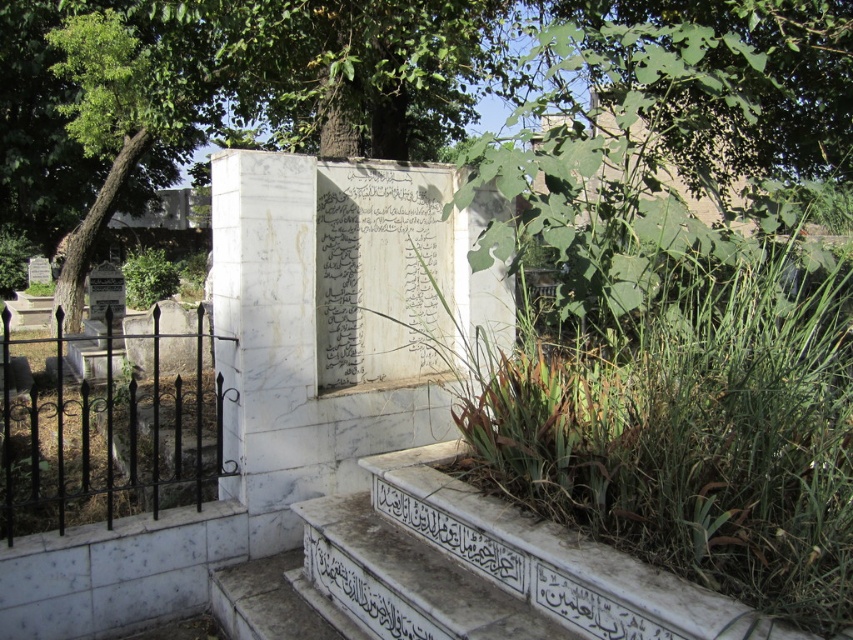
You are a maintenance worker tasked with measuring the width of the black wrought iron fence at left and the black stone inscription at lower center. Based on the scene, which object do you think is wider?

The black wrought iron fence at left might be wider than black stone inscription at lower center according to the description.

You are visiting a cemetery and want to read the black stone inscription at lower center. However, you notice a black wrought iron fence at left. Can you easily access the inscription to read it, or is it blocked by the fence?

The black stone inscription at lower center is behind the black wrought iron fence at left, so it is blocked by the fence and not easily accessible for reading.